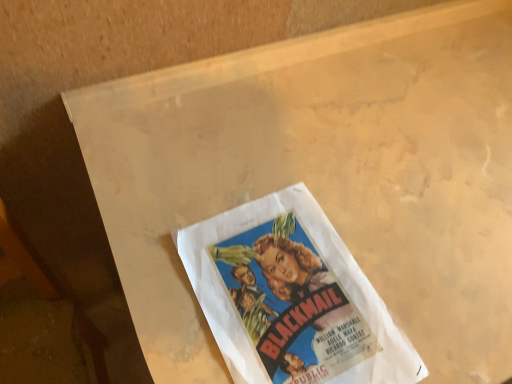
You are a GUI agent. You are given a task and a screenshot of the screen. Output one action in this format:
    pyautogui.click(x=<x>, y=<y>)
    Task: Click on the vacant area on the back side of matte paper poster at center
    This screenshot has height=384, width=512.
    Given the screenshot: What is the action you would take?
    pyautogui.click(x=301, y=157)